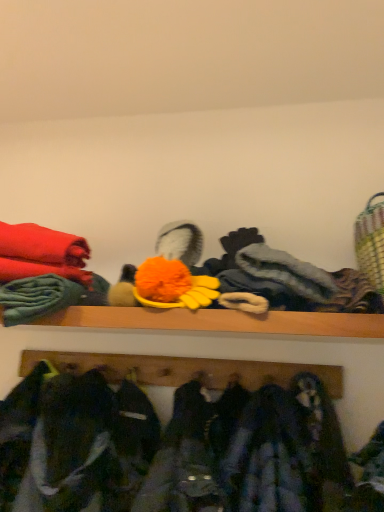
Where is `blank space situated above wooden coat rack at lower center (from a real-world perspective)`? This screenshot has height=512, width=384. blank space situated above wooden coat rack at lower center (from a real-world perspective) is located at coordinates (196, 348).